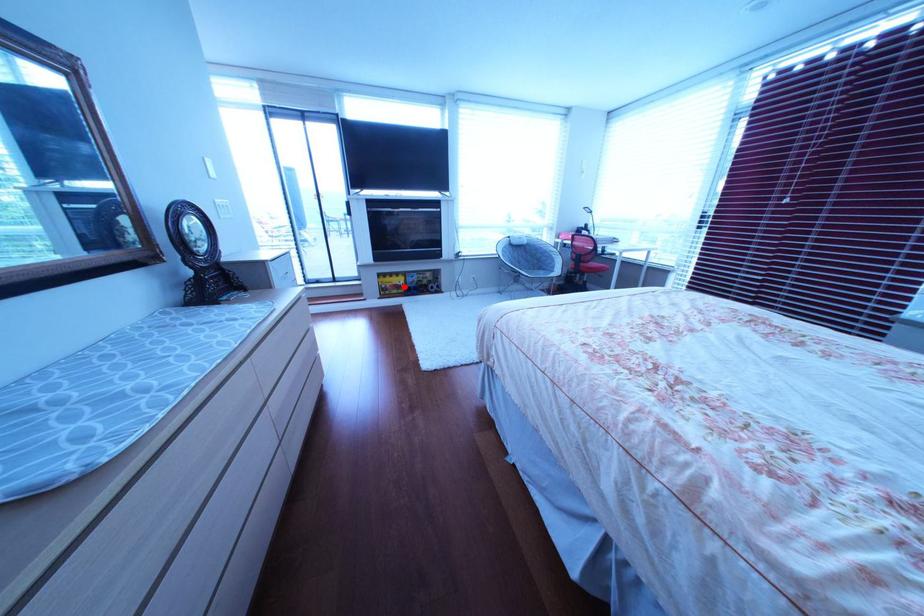
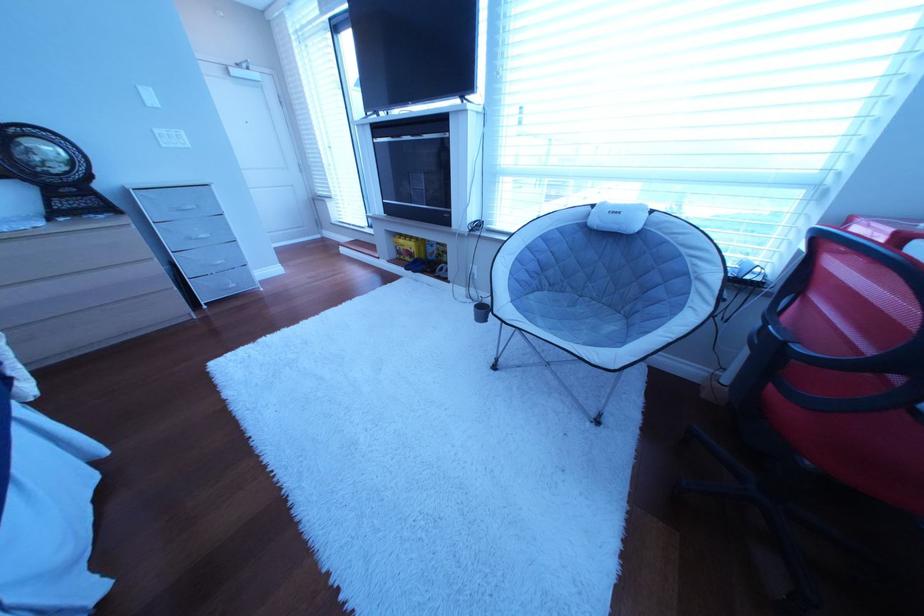
The point at the highlighted location is marked in the first image. Where is the corresponding point in the second image?

(418, 251)